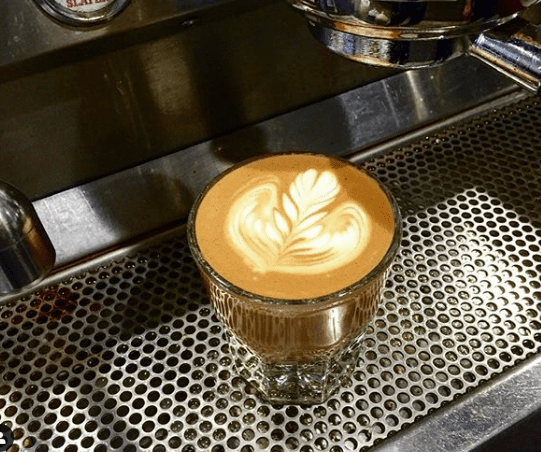
You are a GUI agent. You are given a task and a screenshot of the screen. Output one action in this format:
    pyautogui.click(x=<x>, y=<y>)
    Task: Click on the handle
    The image size is (541, 452).
    Given the screenshot: What is the action you would take?
    pyautogui.click(x=498, y=48)